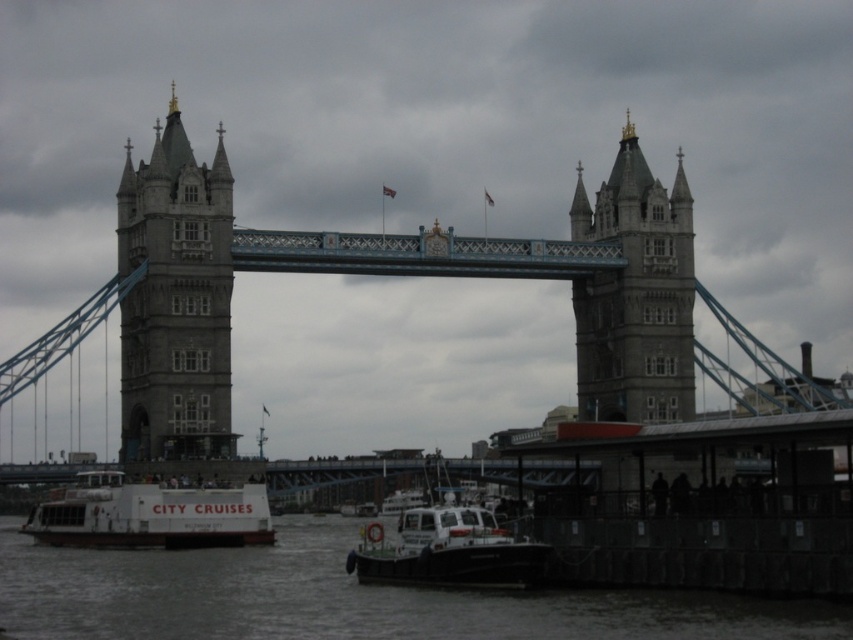
Question: Does white matte water at lower left appear over white plastic boat at lower center?

Choices:
 (A) yes
 (B) no

Answer: (B)

Question: Among these objects, which one is nearest to the camera?

Choices:
 (A) white matte water at lower left
 (B) white plastic boat at lower center
 (C) white matte boat at lower left

Answer: (A)

Question: Among these points, which one is nearest to the camera?

Choices:
 (A) (630, 205)
 (B) (180, 561)

Answer: (B)

Question: Which of these objects is positioned closest to the white plastic boat at lower center?

Choices:
 (A) white matte water at lower left
 (B) white matte boat at lower left
 (C) stone tower at left

Answer: (A)

Question: Is gray stone tower at center to the right of white matte boat at lower left from the viewer's perspective?

Choices:
 (A) yes
 (B) no

Answer: (A)

Question: Considering the relative positions of white matte water at lower left and gray stone tower at center in the image provided, where is white matte water at lower left located with respect to gray stone tower at center?

Choices:
 (A) left
 (B) right

Answer: (A)